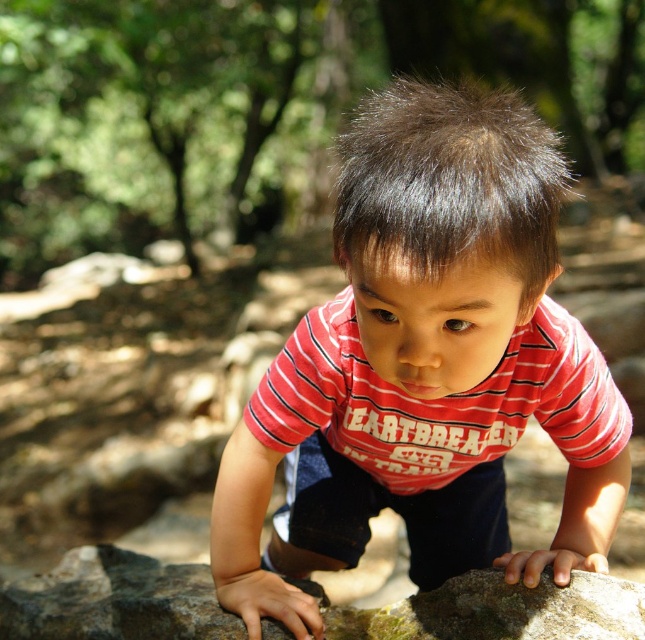
Question: Among these objects, which one is farthest from the camera?

Choices:
 (A) red striped shirt at center
 (B) green mossy rock at center

Answer: (B)

Question: Can you confirm if red striped shirt at center is thinner than green mossy rock at center?

Choices:
 (A) yes
 (B) no

Answer: (A)

Question: Which point appears farthest from the camera in this image?

Choices:
 (A) (464, 577)
 (B) (364, 257)

Answer: (A)

Question: Is red striped shirt at center to the left of green mossy rock at center from the viewer's perspective?

Choices:
 (A) yes
 (B) no

Answer: (B)

Question: Does red striped shirt at center come behind green mossy rock at center?

Choices:
 (A) no
 (B) yes

Answer: (A)